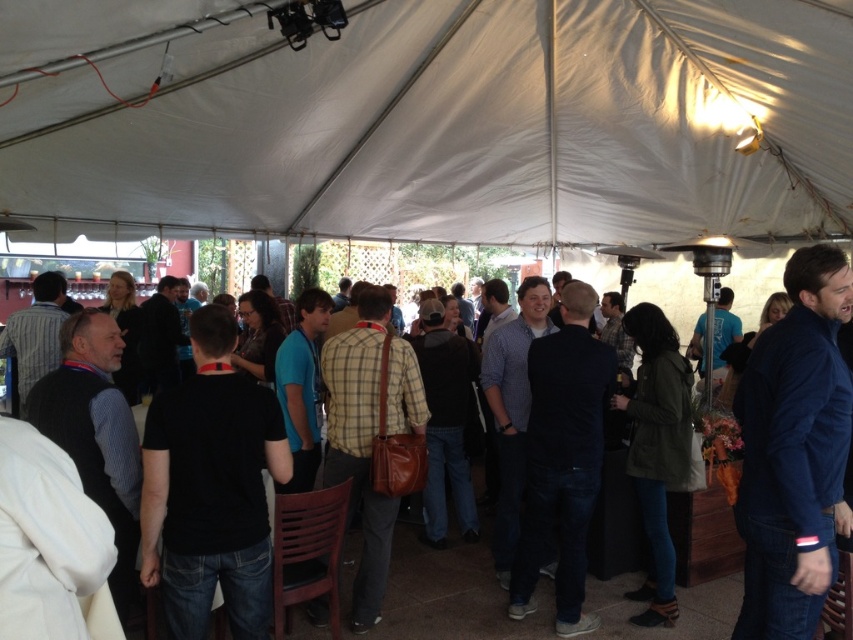
Question: Is white fabric canopy at upper center to the right of black shirt at center from the viewer's perspective?

Choices:
 (A) no
 (B) yes

Answer: (B)

Question: Among these points, which one is farthest from the camera?

Choices:
 (A) (196, 168)
 (B) (451, 573)

Answer: (A)

Question: Among these objects, which one is farthest from the camera?

Choices:
 (A) black shirt at center
 (B) white fabric canopy at upper center

Answer: (B)

Question: Which point is farther to the camera?

Choices:
 (A) black shirt at center
 (B) white fabric canopy at upper center

Answer: (B)

Question: Is white fabric canopy at upper center to the right of black shirt at center from the viewer's perspective?

Choices:
 (A) yes
 (B) no

Answer: (A)

Question: Does white fabric canopy at upper center have a smaller size compared to black shirt at center?

Choices:
 (A) yes
 (B) no

Answer: (A)